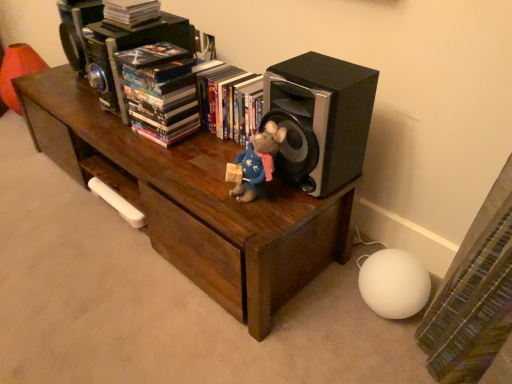
The image size is (512, 384). Identify the location of free location in front of velvety blue plush at center. (258, 218).